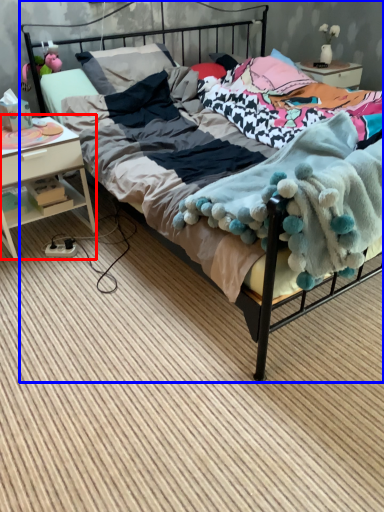
Question: Which point is further to the camera, nightstand (highlighted by a red box) or bed (highlighted by a blue box)?

Choices:
 (A) nightstand
 (B) bed

Answer: (A)